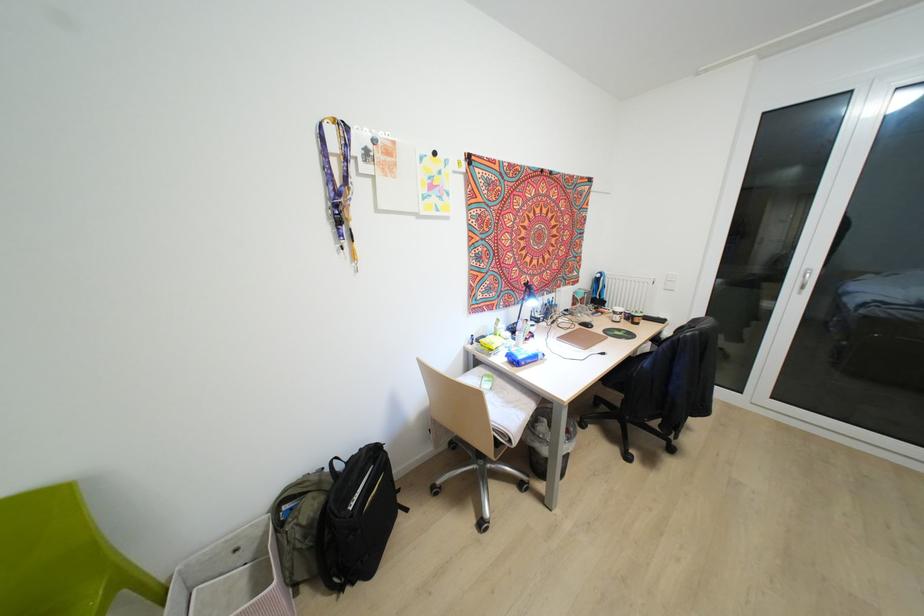
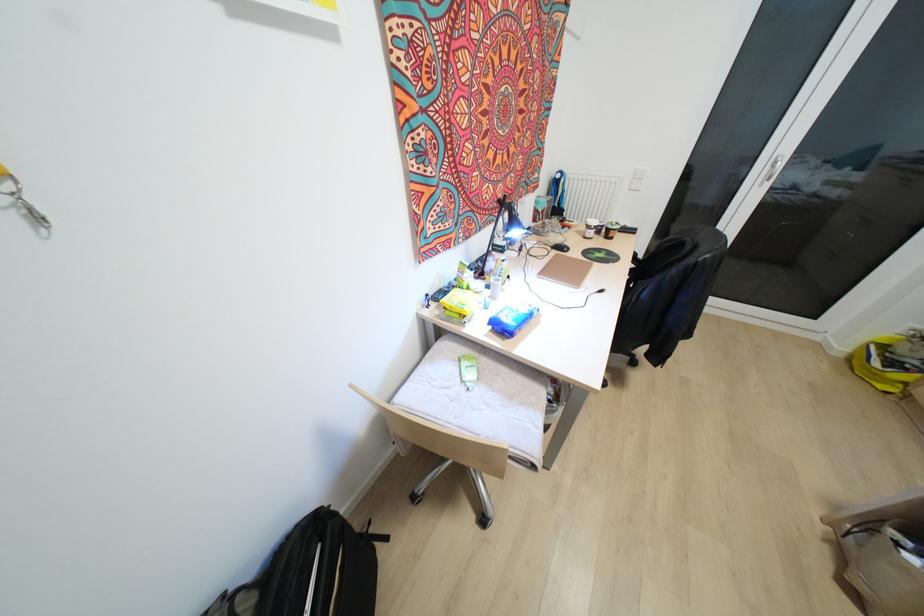
Where in the second image is the point corresponding to point 618,309 from the first image?

(592, 222)